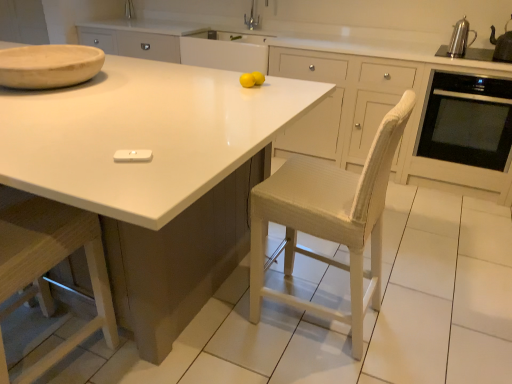
At what (x,y) coordinates should I click in order to perform the action: click on free space in front of white matte remote control at center, the 2th appliance in the right-to-left sequence. Please return your answer as a coordinate pair (x, y). Looking at the image, I should click on (120, 185).